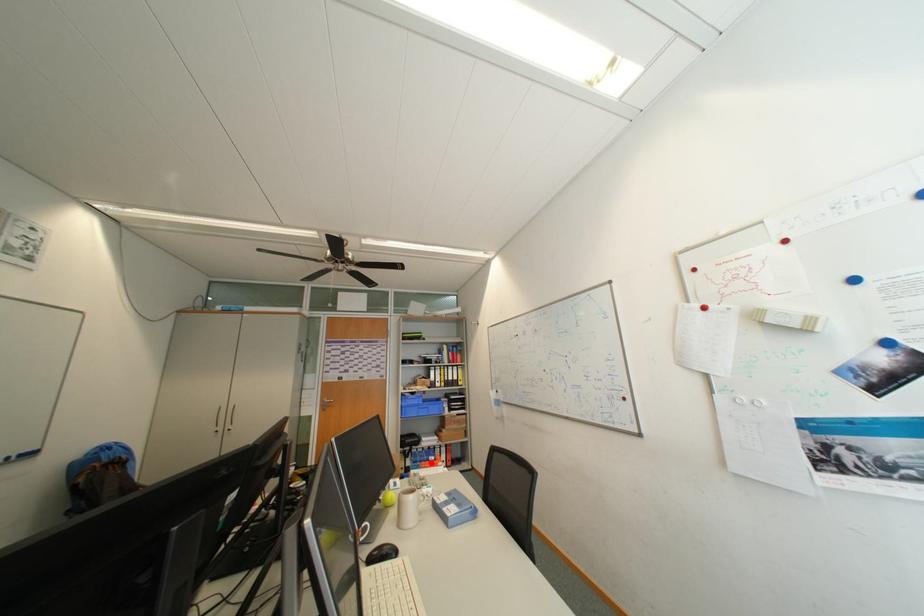
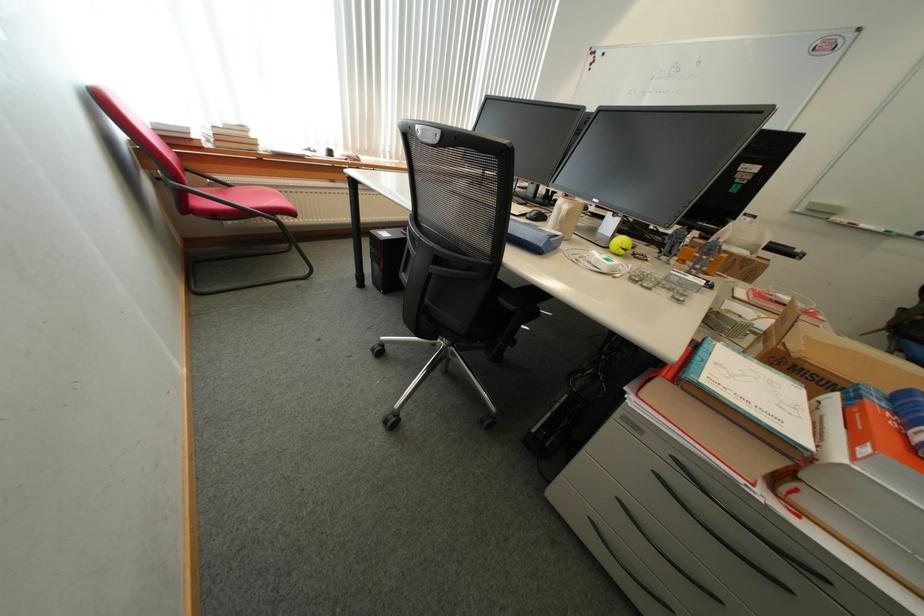
Question: I am providing you with two images of the same scene from different viewpoints. In image1, a red point is highlighted. Considering the same 3D point in image2, which of the following is correct?

Choices:
 (A) It is closer
 (B) It is farther

Answer: (A)